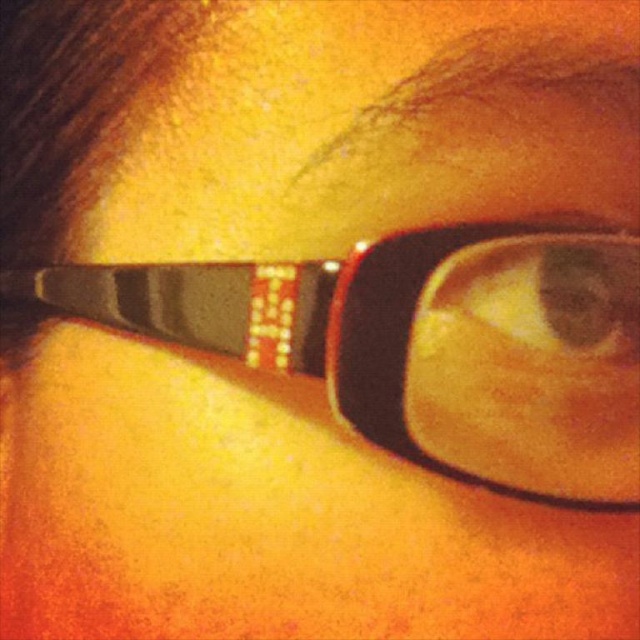
Question: Among these points, which one is nearest to the camera?

Choices:
 (A) (557, 288)
 (B) (493, 268)

Answer: (B)

Question: Which point is farther to the camera?

Choices:
 (A) (522, 346)
 (B) (570, 289)

Answer: (A)

Question: Observing the image, what is the correct spatial positioning of matte black glasses at center in reference to matte plastic eye at center?

Choices:
 (A) below
 (B) above

Answer: (A)

Question: Which object is farther from the camera taking this photo?

Choices:
 (A) matte black glasses at center
 (B) matte plastic eye at center

Answer: (B)

Question: Can you confirm if matte black glasses at center is positioned to the left of matte plastic eye at center?

Choices:
 (A) yes
 (B) no

Answer: (A)

Question: Can you confirm if matte black glasses at center is positioned to the right of matte plastic eye at center?

Choices:
 (A) no
 (B) yes

Answer: (A)